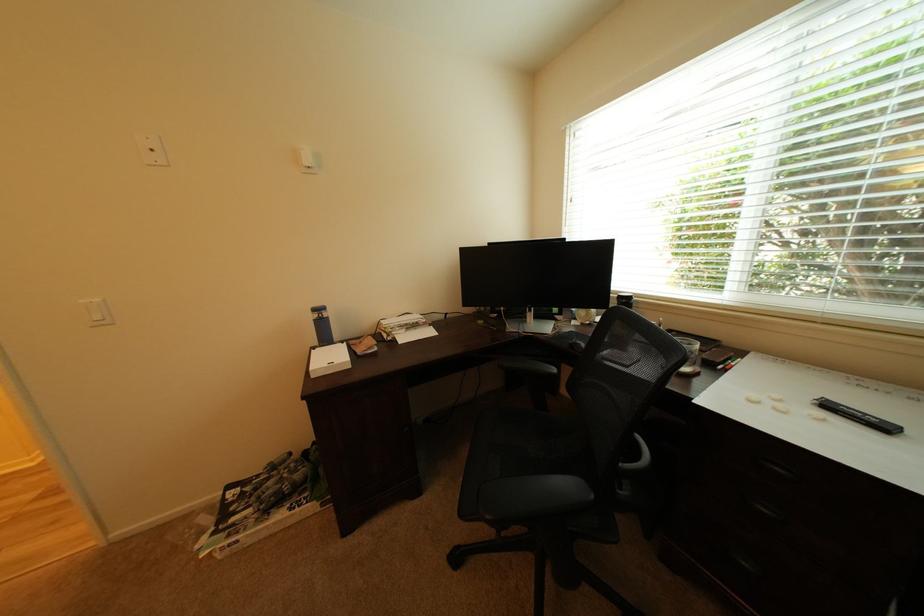
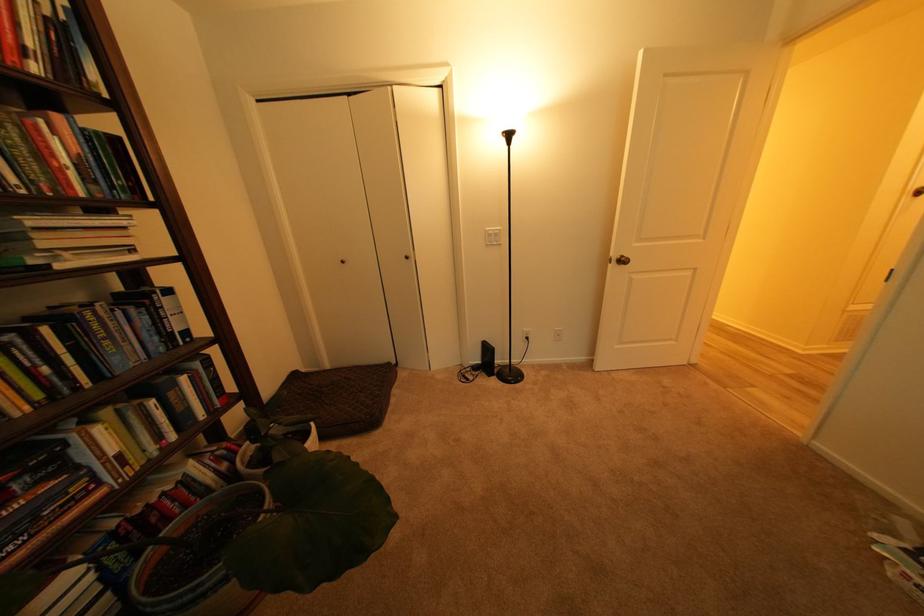
Based on the continuous images, in which direction is the camera rotating?

The camera's rotation is toward left-down.